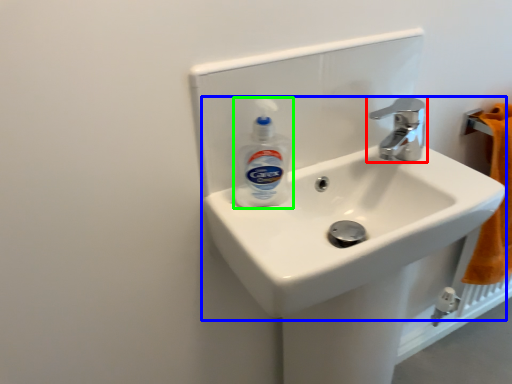
Question: Based on their relative distances, which object is farther from tap (highlighted by a red box)? Choose from sink (highlighted by a blue box) and cleaning product (highlighted by a green box).

Choices:
 (A) sink
 (B) cleaning product

Answer: (B)